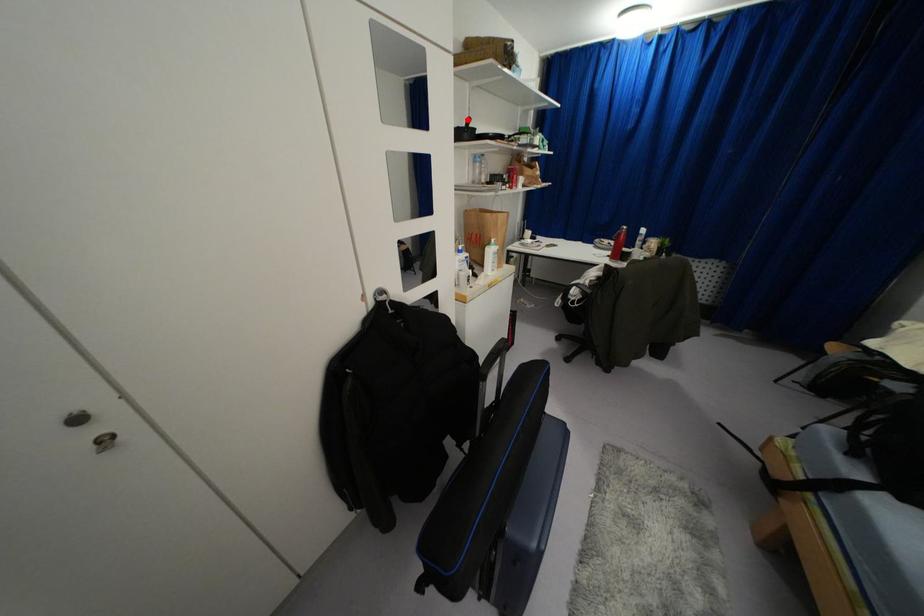
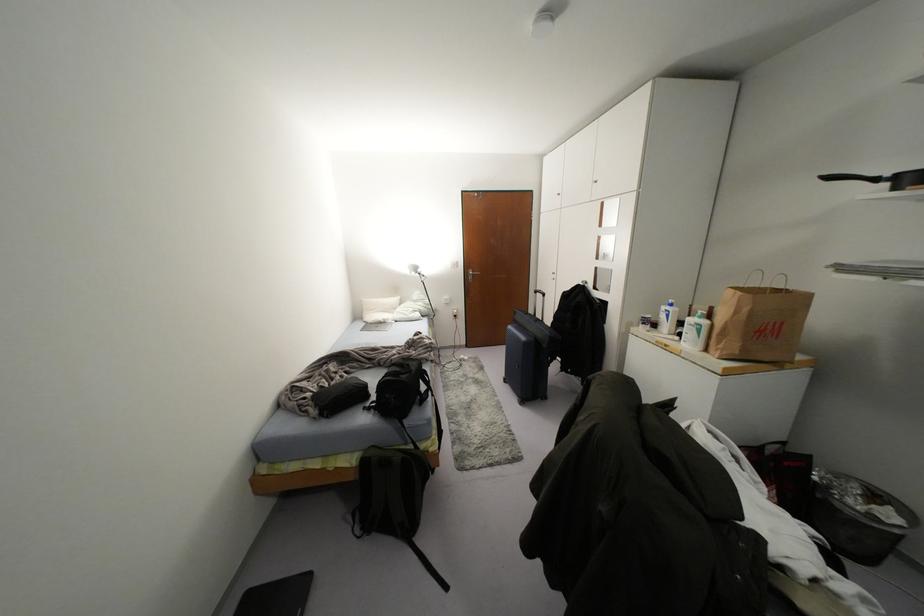
Locate, in the second image, the point that corresponds to the highlighted location in the first image.

(829, 177)